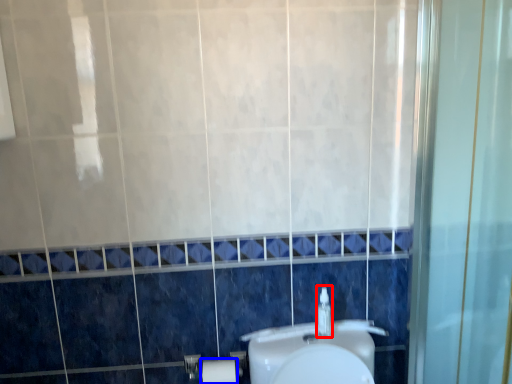
Question: Which point is further to the camera, soap dispenser (highlighted by a red box) or toilet paper (highlighted by a blue box)?

Choices:
 (A) soap dispenser
 (B) toilet paper

Answer: (B)